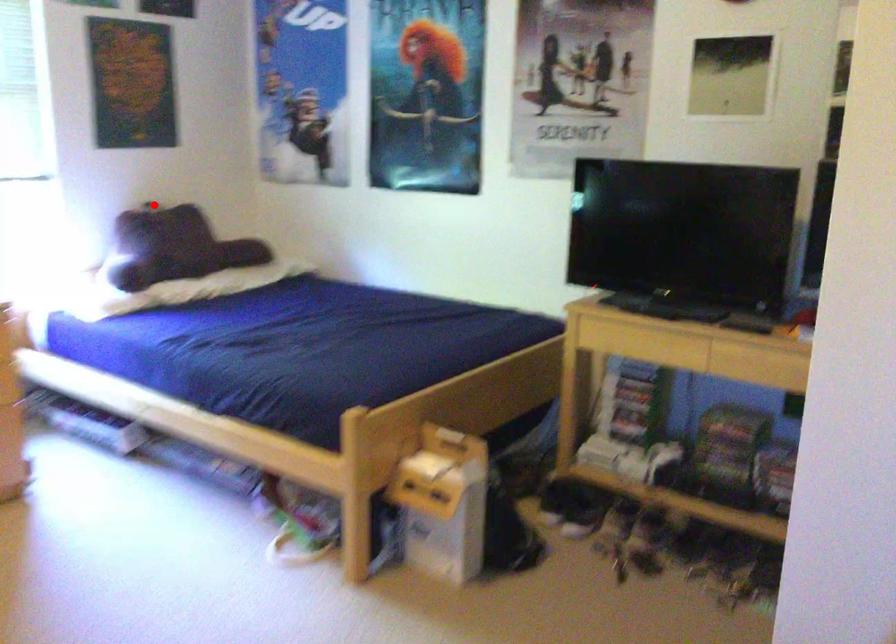
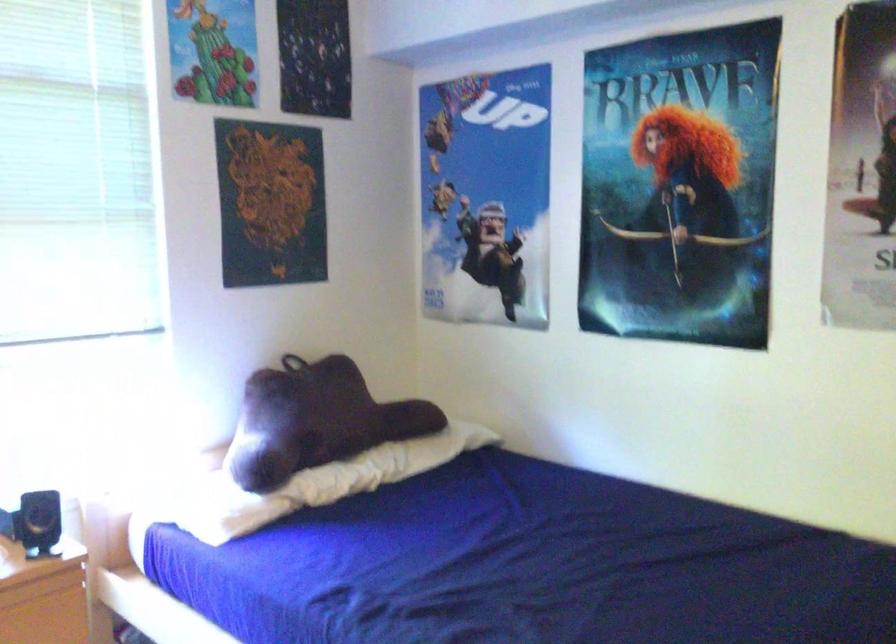
Question: I am providing you with two images of the same scene from different viewpoints. Given a red point in image1, look at the same physical point in image2. Is it:

Choices:
 (A) Closer to the viewpoint
 (B) Farther from the viewpoint

Answer: (A)